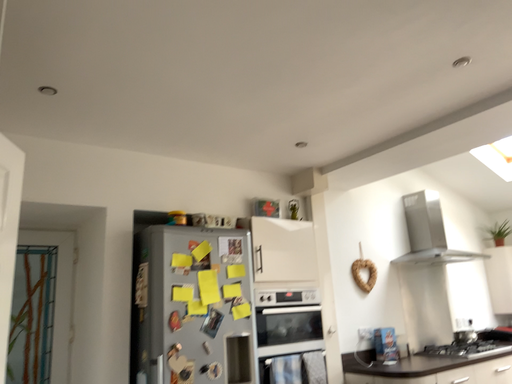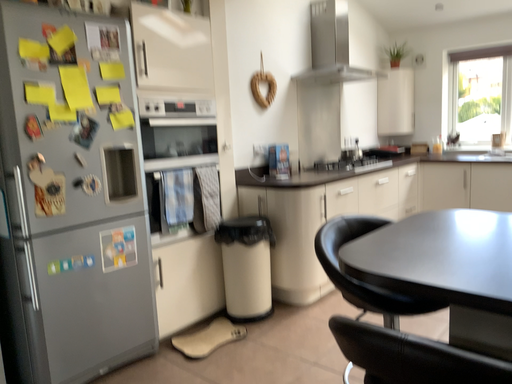
Question: How did the camera likely rotate when shooting the video?

Choices:
 (A) rotated left
 (B) rotated right

Answer: (B)